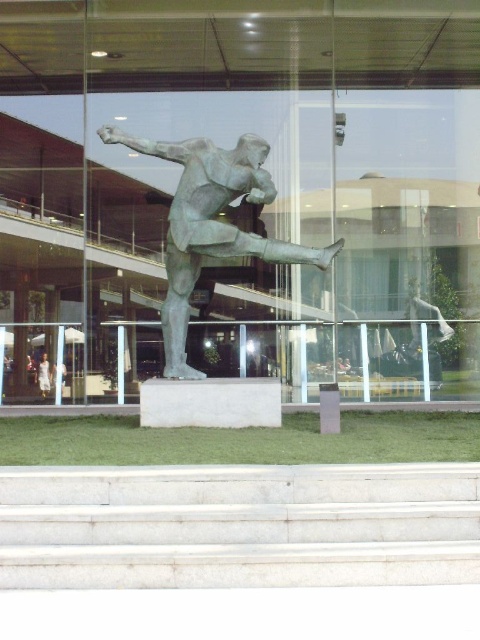
Question: Can you confirm if white marble stairs at center is positioned to the right of green patina statue at center?

Choices:
 (A) yes
 (B) no

Answer: (A)

Question: Among these objects, which one is nearest to the camera?

Choices:
 (A) green patina statue at center
 (B) white marble stairs at center

Answer: (B)

Question: Does white marble stairs at center appear on the right side of green patina statue at center?

Choices:
 (A) yes
 (B) no

Answer: (A)

Question: Which point is closer to the camera?

Choices:
 (A) white marble stairs at center
 (B) green patina statue at center

Answer: (A)

Question: Is white marble stairs at center in front of green patina statue at center?

Choices:
 (A) yes
 (B) no

Answer: (A)

Question: Among these points, which one is farthest from the camera?

Choices:
 (A) (141, 152)
 (B) (383, 468)

Answer: (A)